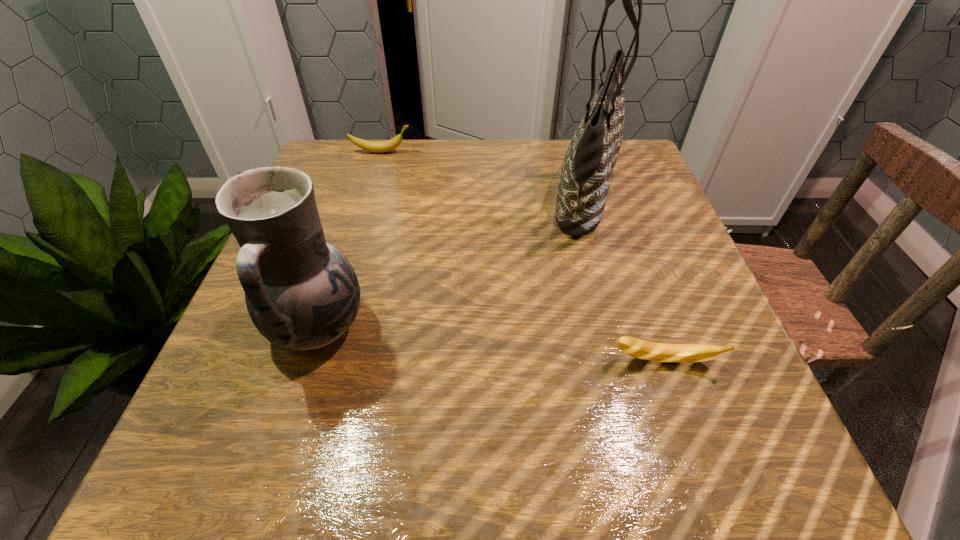
Where is `vacant area at the right edge of the desktop`? This screenshot has width=960, height=540. vacant area at the right edge of the desktop is located at coordinates (675, 255).

Find the location of a particular element. This screenshot has height=540, width=960. free spot at the far left corner of the desktop is located at coordinates (338, 186).

What are the coordinates of `free region at the near left corner` in the screenshot? It's located at (159, 476).

Find the location of a particular element. free region at the far right corner of the desktop is located at coordinates (637, 146).

Image resolution: width=960 pixels, height=540 pixels. What are the coordinates of `empty space between the second tallest object and the shorter banana` in the screenshot? It's located at (491, 345).

Locate an element on the screen. Image resolution: width=960 pixels, height=540 pixels. free space between the nearer banana and the pitcher is located at coordinates (491, 345).

This screenshot has width=960, height=540. Identify the location of blank region between the tote bag and the shortest object. (625, 276).

At what (x,y) coordinates should I click in order to perform the action: click on free space between the pitcher and the tote bag. Please return your answer as a coordinate pair (x, y). The height and width of the screenshot is (540, 960). Looking at the image, I should click on (452, 259).

Find the location of a particular element. The height and width of the screenshot is (540, 960). unoccupied area between the farther banana and the nearer banana is located at coordinates (522, 256).

You are a GUI agent. You are given a task and a screenshot of the screen. Output one action in this format:
    pyautogui.click(x=<x>, y=<y>)
    Task: Click on the vacant region between the taller banana and the tallest object
    
    Given the screenshot: What is the action you would take?
    pyautogui.click(x=484, y=171)